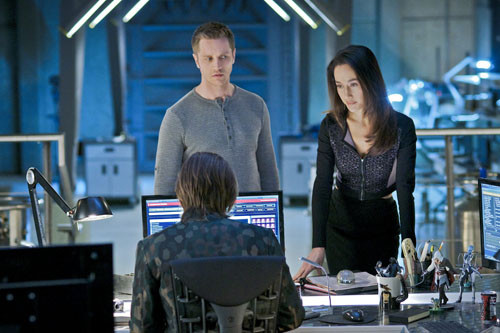
Locate an element on the screen. The image size is (500, 333). desk lamp with adjustable arm is located at coordinates (85, 209).